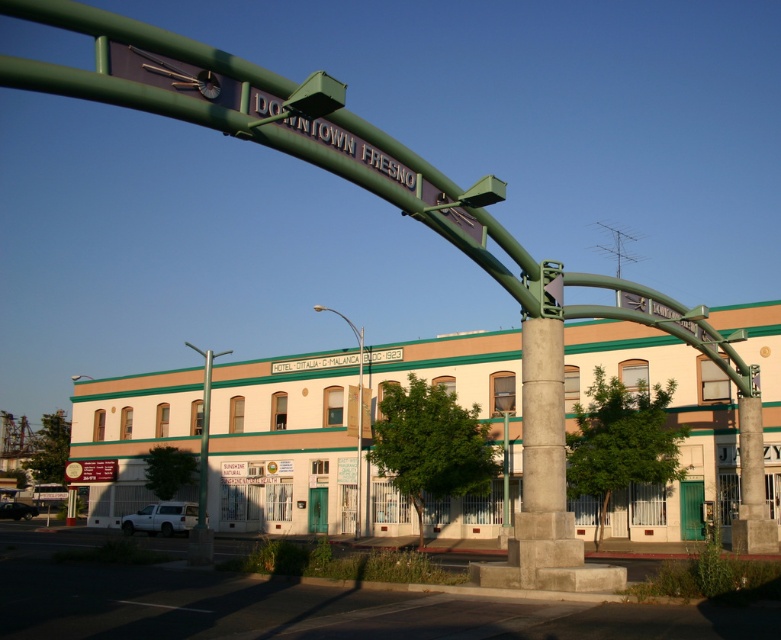
Question: Is metallic pole at center bigger than metallic street light at lower left?

Choices:
 (A) yes
 (B) no

Answer: (B)

Question: Among these objects, which one is farthest from the camera?

Choices:
 (A) metallic pole at center
 (B) green metallic pole at center
 (C) metallic street light at lower left

Answer: (C)

Question: Which point is farther to the camera?

Choices:
 (A) metallic street light at lower left
 (B) metallic pole at center
 (C) green metallic pole at center

Answer: (A)

Question: Which object appears closest to the camera in this image?

Choices:
 (A) green metallic pole at center
 (B) metallic pole at center

Answer: (A)

Question: Where is metallic pole at center located in relation to metallic street light at lower left in the image?

Choices:
 (A) left
 (B) right

Answer: (B)

Question: Can you confirm if green metallic pole at center is positioned below metallic pole at center?

Choices:
 (A) no
 (B) yes

Answer: (B)